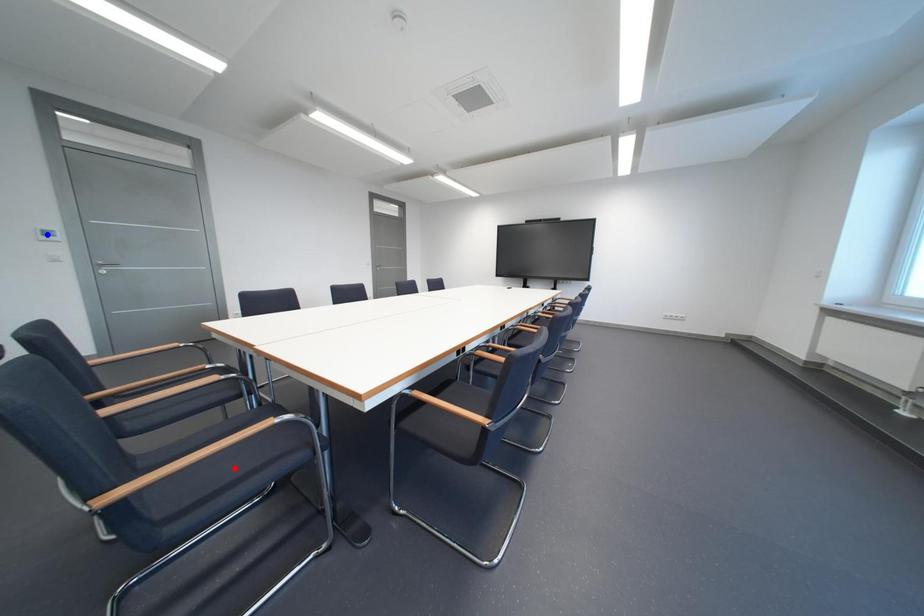
Question: Which of the two points in the image is closer to the camera?

Choices:
 (A) Blue point is closer.
 (B) Red point is closer.

Answer: (B)